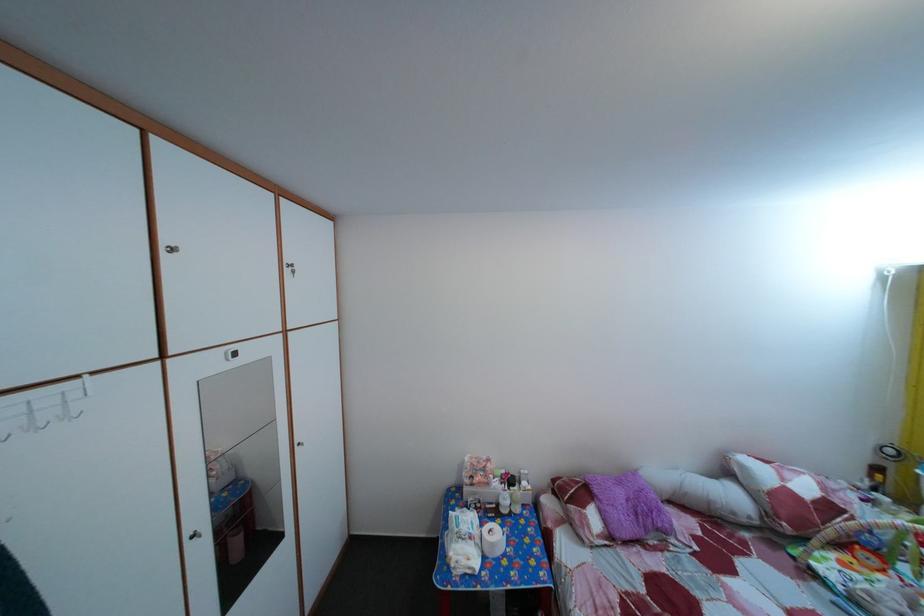
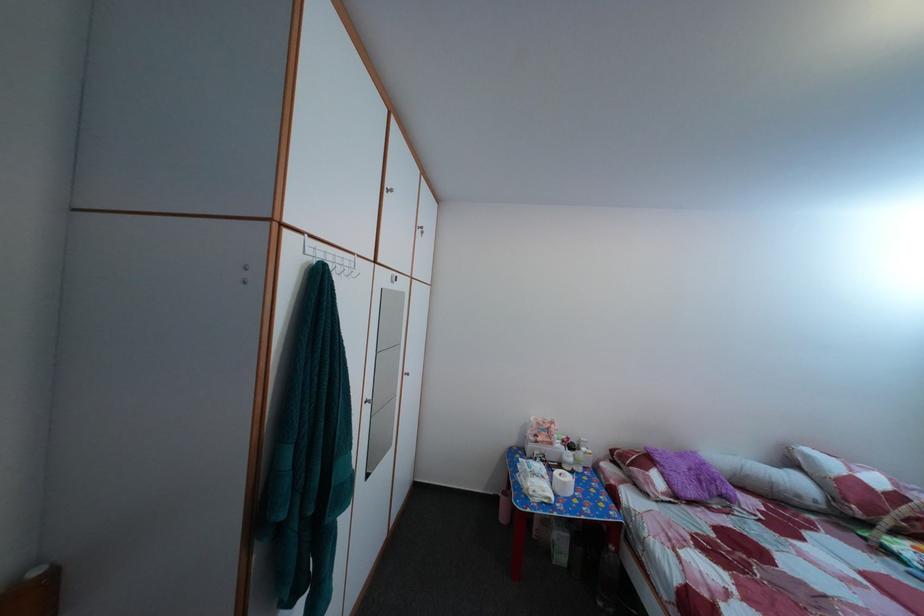
Where in the second image is the point corresponding to point 490,516 from the first image?

(555, 469)